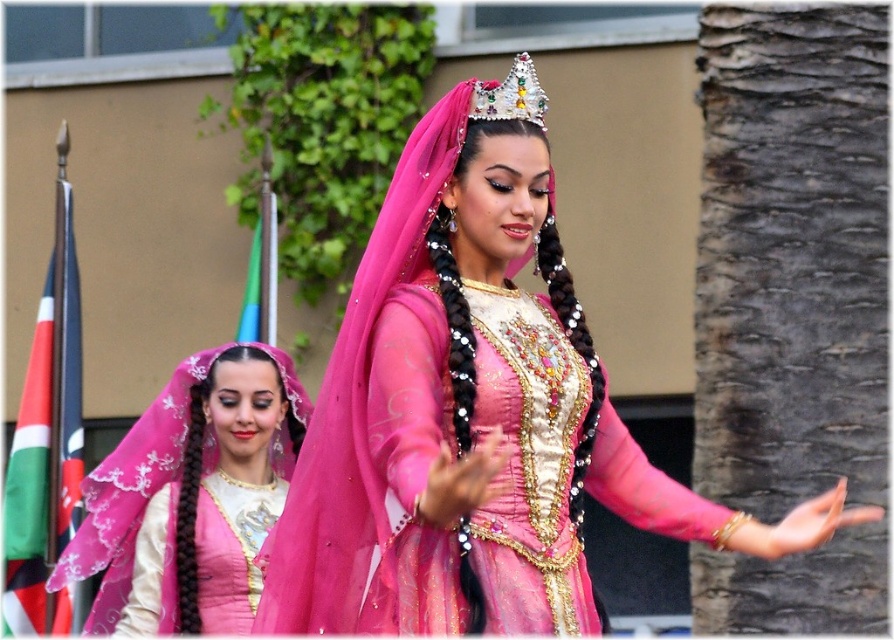
Does matte pink dress at center have a greater height compared to matte pink fabric at center?

Correct, matte pink dress at center is much taller as matte pink fabric at center.

Between point (496, 461) and point (111, 595), which one is positioned in front?

Positioned in front is point (496, 461).

I want to click on matte pink dress at center, so click(x=474, y=420).

Is matte pink dress at center in front of sparkling silver crown at center?

Yes, it is.

In the scene shown: Who is shorter, matte pink dress at center or sparkling silver crown at center?

sparkling silver crown at center is shorter.

Locate an element on the screen. matte pink dress at center is located at coordinates (474, 420).

Which of these two, matte pink fabric at center or sparkling silver crown at center, stands shorter?

With less height is sparkling silver crown at center.

Does matte pink fabric at center have a greater width compared to sparkling silver crown at center?

Yes.

Identify the location of matte pink fabric at center. (190, 497).